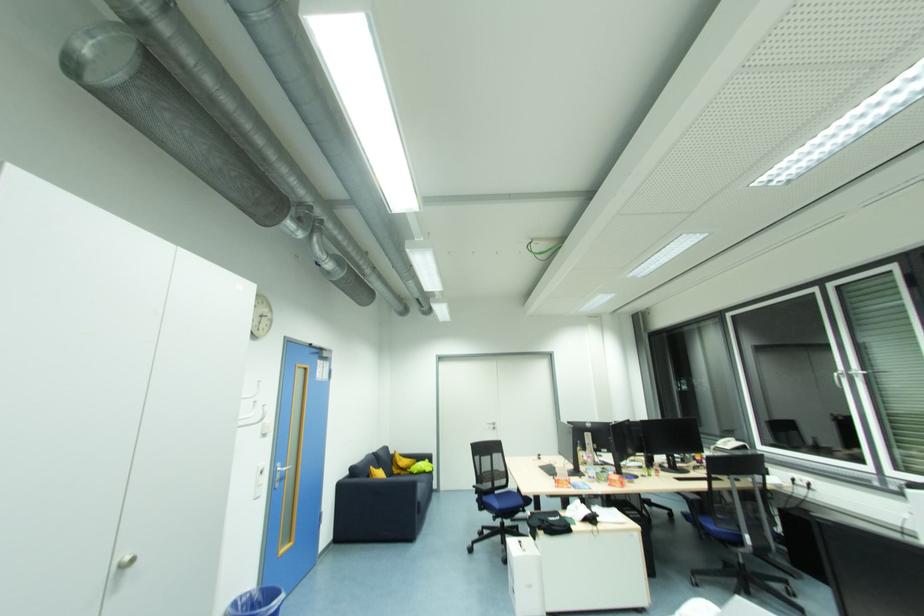
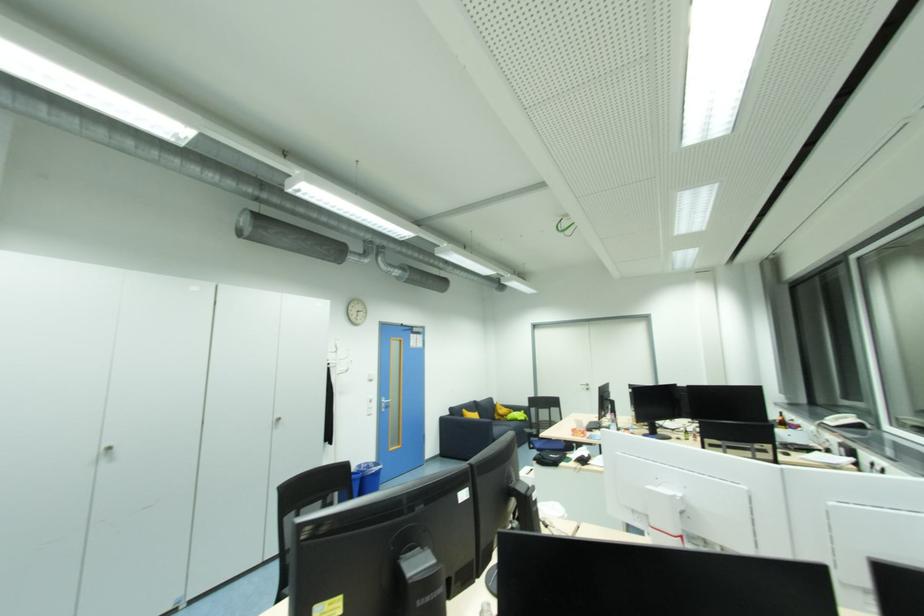
Locate, in the second image, the point that corresponds to pixel 430 461 in the first image.

(526, 413)